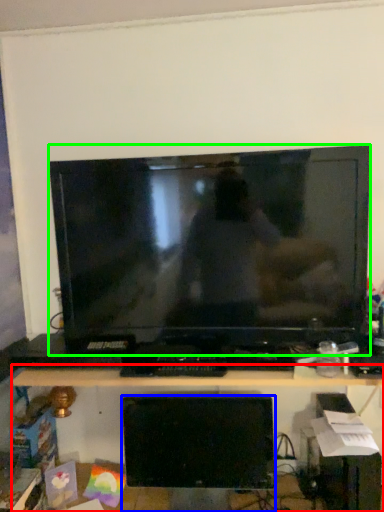
Question: Which object is the farthest from desk (highlighted by a red box)? Choose among these: computer monitor (highlighted by a blue box) or television (highlighted by a green box).

Choices:
 (A) computer monitor
 (B) television

Answer: (B)